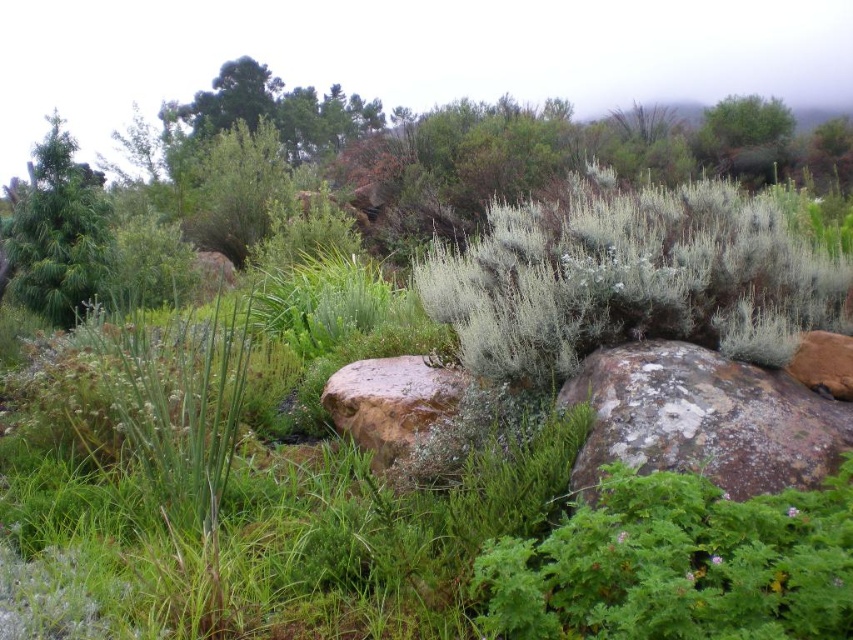
You are standing in the natural landscape scene. There are two points marked in the image. The first point is at coordinates point (630, 449) and the second is at point (374, 369). Which point is closer to your current position?

Point (630, 449) is closer to the camera than point (374, 369), so the first point is closer to your current position.

You are standing in the natural landscape and want to walk from the brown rough boulder at center to the green matte pine tree at left. Which direction should you move to get closer to the tree?

Since the brown rough boulder at center is closer to the viewer than the green matte pine tree at left, you should move backward to get closer to the green matte pine tree at left.